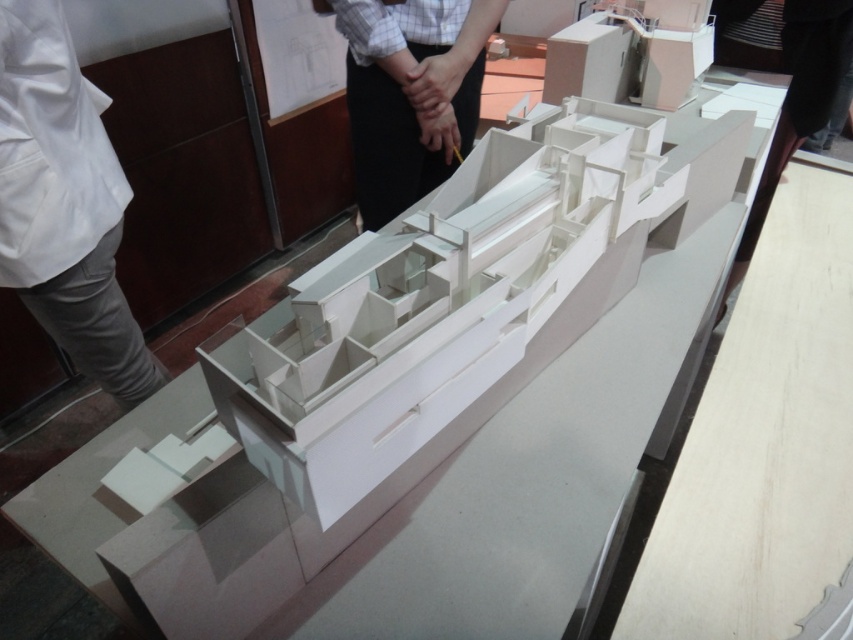
Is white cotton pants at lower left taller than white paper at upper center?

Correct, white cotton pants at lower left is much taller as white paper at upper center.

Is point (105, 372) more distant than point (450, 100)?

No.

Which is in front, point (35, 100) or point (445, 8)?

Point (35, 100) is in front.

This screenshot has height=640, width=853. I want to click on white cotton pants at lower left, so click(64, 204).